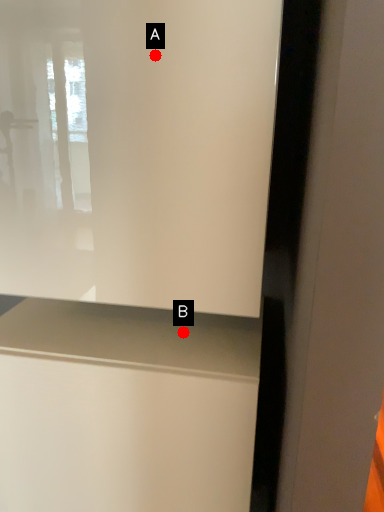
Question: Two points are circled on the image, labeled by A and B beside each circle. Which point appears farthest from the camera in this image?

Choices:
 (A) A is further
 (B) B is further

Answer: (B)